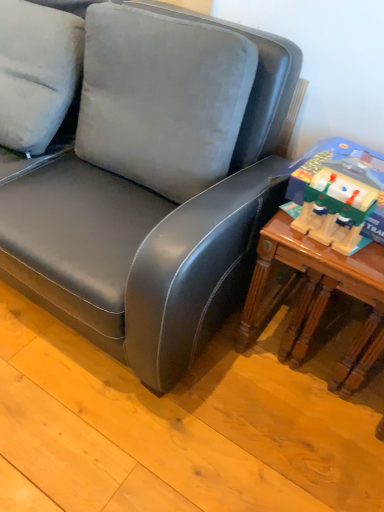
At what (x,y) coordinates should I click in order to perform the action: click on wooden train set at right. Please return your answer as a coordinate pair (x, y). Looking at the image, I should click on (338, 204).

The width and height of the screenshot is (384, 512). Describe the element at coordinates (338, 204) in the screenshot. I see `wooden train set at right` at that location.

Identify the location of wooden table at right. pyautogui.click(x=316, y=297).

What do you see at coordinates (316, 297) in the screenshot? I see `wooden table at right` at bounding box center [316, 297].

The image size is (384, 512). Identify the location of wooden train set at right. (338, 204).

Is wooden train set at right to the right of wooden table at right from the viewer's perspective?

Incorrect, wooden train set at right is not on the right side of wooden table at right.

Does wooden train set at right come behind wooden table at right?

No, it is not.

Is point (327, 176) closer or farther from the camera than point (380, 264)?

Point (327, 176) is farther from the camera than point (380, 264).

Looking at this image, from the image's perspective, is wooden train set at right below wooden table at right?

No, from the image's perspective, wooden train set at right is not beneath wooden table at right.

From a real-world perspective, is wooden train set at right on wooden table at right?

Yes, from a real-world perspective, wooden train set at right is on top of wooden table at right.

Which object is wider, wooden train set at right or wooden table at right?

Wider between the two is wooden table at right.

Does wooden train set at right have a greater height compared to wooden table at right?

No, wooden train set at right is not taller than wooden table at right.

Considering the relative sizes of wooden train set at right and wooden table at right in the image provided, is wooden train set at right smaller than wooden table at right?

Yes, wooden train set at right is smaller than wooden table at right.

Is wooden train set at right situated inside wooden table at right or outside?

wooden train set at right lies outside wooden table at right.

Are wooden train set at right and wooden table at right far apart?

No, there isn't a large distance between wooden train set at right and wooden table at right.

Is wooden train set at right looking in the opposite direction of wooden table at right?

No.

Find the location of a particular element. This screenshot has width=384, height=512. toy above the wooden table at right (from the image's perspective) is located at coordinates (338, 204).

Looking at this image, which is more to the right, wooden table at right or wooden train set at right?

wooden table at right is more to the right.

Which object is closer to the camera, wooden table at right or wooden train set at right?

wooden train set at right is in front.

Which is closer, (252, 314) or (351, 224)?

Clearly, point (252, 314) is more distant from the camera than point (351, 224).

From the image's perspective, who appears lower, wooden table at right or wooden train set at right?

wooden table at right appears lower in the image.

From a real-world perspective, which is physically below, wooden table at right or wooden train set at right?

wooden table at right.

Between wooden table at right and wooden train set at right, which one has larger width?

wooden table at right is wider.

Does wooden table at right have a lesser height compared to wooden train set at right?

Incorrect, the height of wooden table at right does not fall short of that of wooden train set at right.

Is wooden table at right bigger than wooden train set at right?

Correct, wooden table at right is larger in size than wooden train set at right.

Is wooden table at right not inside wooden train set at right?

Yes.

Is wooden table at right not near wooden train set at right?

That's not correct — wooden table at right is a little close to wooden train set at right.

Is wooden table at right oriented towards wooden train set at right?

No, wooden table at right is not oriented towards wooden train set at right.

Can you tell me how much wooden table at right and wooden train set at right differ in facing direction?

The facing directions of wooden table at right and wooden train set at right are 0.00366 degrees apart.

The width and height of the screenshot is (384, 512). In order to click on table on the right of the wooden train set at right in this screenshot , I will do (x=316, y=297).

Locate an element on the screen. Image resolution: width=384 pixels, height=512 pixels. toy in front of the wooden table at right is located at coordinates (338, 204).

This screenshot has width=384, height=512. I want to click on toy on the left of wooden table at right, so click(x=338, y=204).